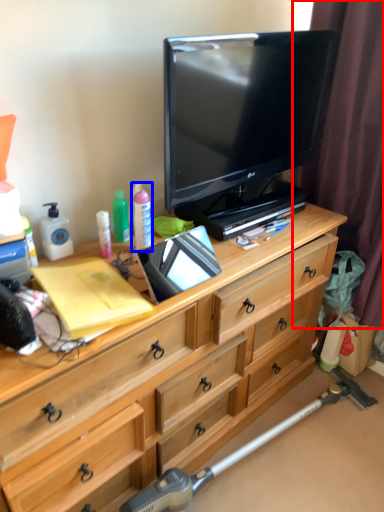
Question: Among these objects, which one is farthest to the camera, curtain (highlighted by a red box) or toiletry (highlighted by a blue box)?

Choices:
 (A) curtain
 (B) toiletry

Answer: (B)